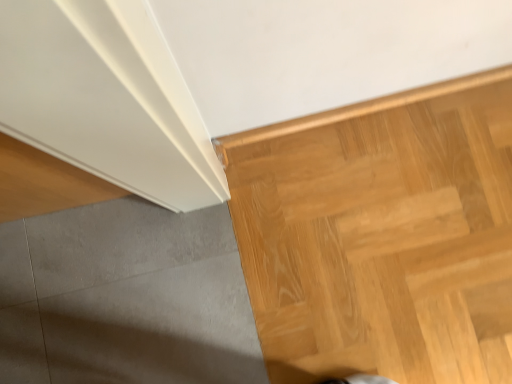
Where is `free space above wooden parquet floor at lower right (from a real-world perspective)`? This screenshot has height=384, width=512. free space above wooden parquet floor at lower right (from a real-world perspective) is located at coordinates (287, 279).